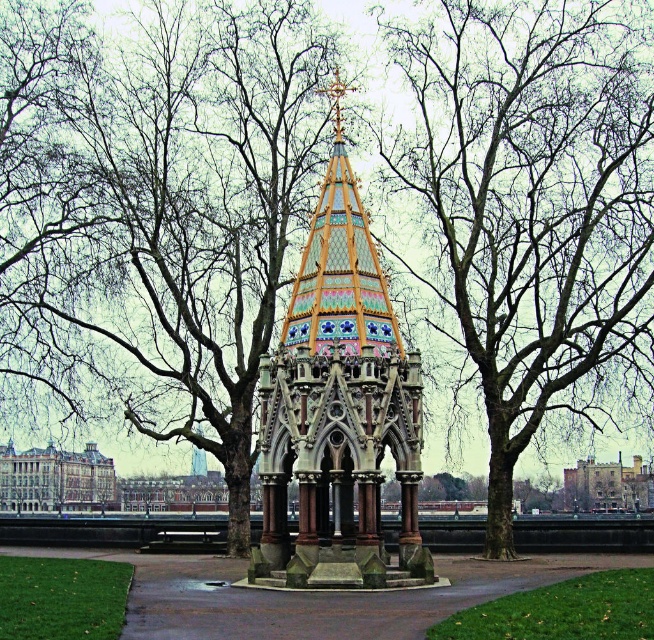
Can you confirm if multicolored mosaic gazebo at center is bigger than brown stone church at center?

Indeed, multicolored mosaic gazebo at center has a larger size compared to brown stone church at center.

How distant is multicolored mosaic gazebo at center from brown stone church at center?

They are 192.56 feet apart.

You are a GUI agent. You are given a task and a screenshot of the screen. Output one action in this format:
    pyautogui.click(x=<x>, y=<y>)
    Task: Click on the multicolored mosaic gazebo at center
    This screenshot has height=640, width=654.
    Given the screenshot: What is the action you would take?
    pyautogui.click(x=337, y=410)

Is the position of brown bark tree at center more distant than that of brown stone church at center?

No, brown bark tree at center is in front of brown stone church at center.

Who is taller, brown bark tree at center or brown stone church at center?

Standing taller between the two is brown bark tree at center.

The image size is (654, 640). What do you see at coordinates (528, 204) in the screenshot?
I see `brown bark tree at center` at bounding box center [528, 204].

What are the coordinates of `brown bark tree at center` in the screenshot? It's located at (528, 204).

Is brown stone church at center shorter than brick stone church at center?

No.

Does point (88, 445) come closer to viewer compared to point (596, 486)?

That is True.

At what (x,y) coordinates should I click in order to perform the action: click on brown stone church at center. Please return your answer as a coordinate pair (x, y). The image size is (654, 640). Looking at the image, I should click on (56, 477).